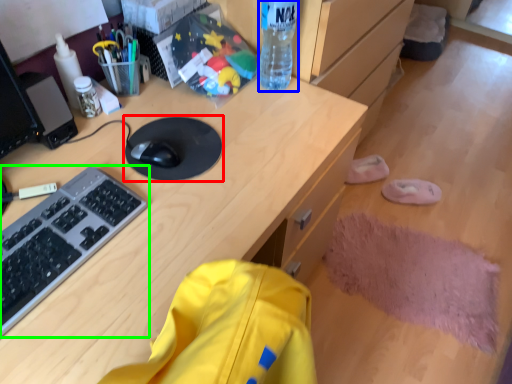
Question: Based on their relative distances, which object is farther from mousepad (highlighted by a red box)? Choose from bottle (highlighted by a blue box) and computer keyboard (highlighted by a green box).

Choices:
 (A) bottle
 (B) computer keyboard

Answer: (A)